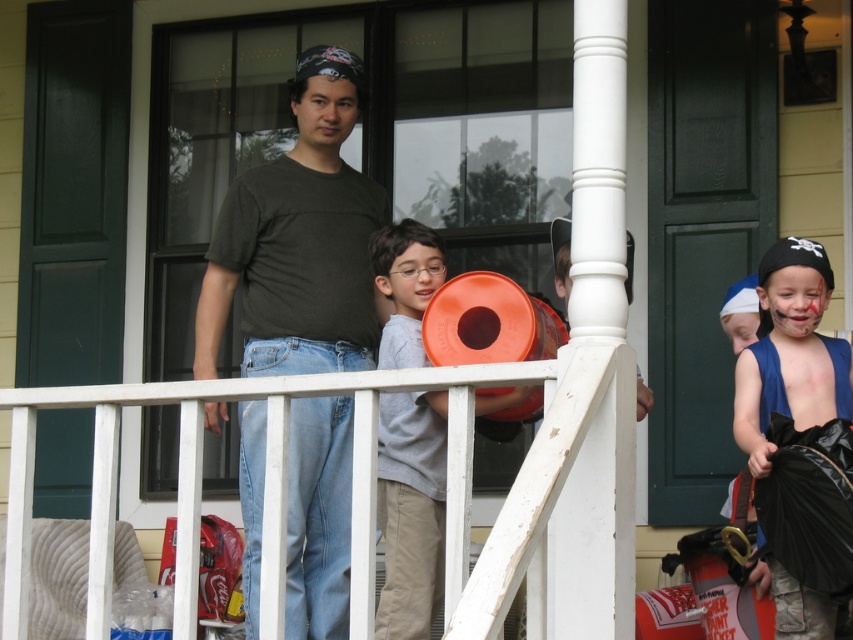
Can you confirm if orange matte bucket at center is positioned to the left of shiny blue fabric at right?

Indeed, orange matte bucket at center is positioned on the left side of shiny blue fabric at right.

Which is above, orange matte bucket at center or shiny blue fabric at right?

Positioned higher is shiny blue fabric at right.

Between point (410, 316) and point (779, 392), which one is positioned in front?

Point (779, 392) is more forward.

Image resolution: width=853 pixels, height=640 pixels. What are the coordinates of `orange matte bucket at center` in the screenshot? It's located at (410, 509).

Can you confirm if white wooden rail at center is smaller than orange matte bucket at center?

Actually, white wooden rail at center might be larger than orange matte bucket at center.

From the picture: Is white wooden rail at center further to the viewer compared to orange matte bucket at center?

No, white wooden rail at center is in front of orange matte bucket at center.

Between point (538, 593) and point (421, 420), which one is positioned behind?

Positioned behind is point (421, 420).

Find the location of a particular element. This screenshot has height=640, width=853. white wooden rail at center is located at coordinates (374, 493).

In the scene shown: Is white wooden rail at center shorter than dark green t-shirt at center?

Yes, white wooden rail at center is shorter than dark green t-shirt at center.

Does point (451, 563) come behind point (314, 544)?

That is False.

Identify the location of white wooden rail at center. This screenshot has height=640, width=853. (374, 493).